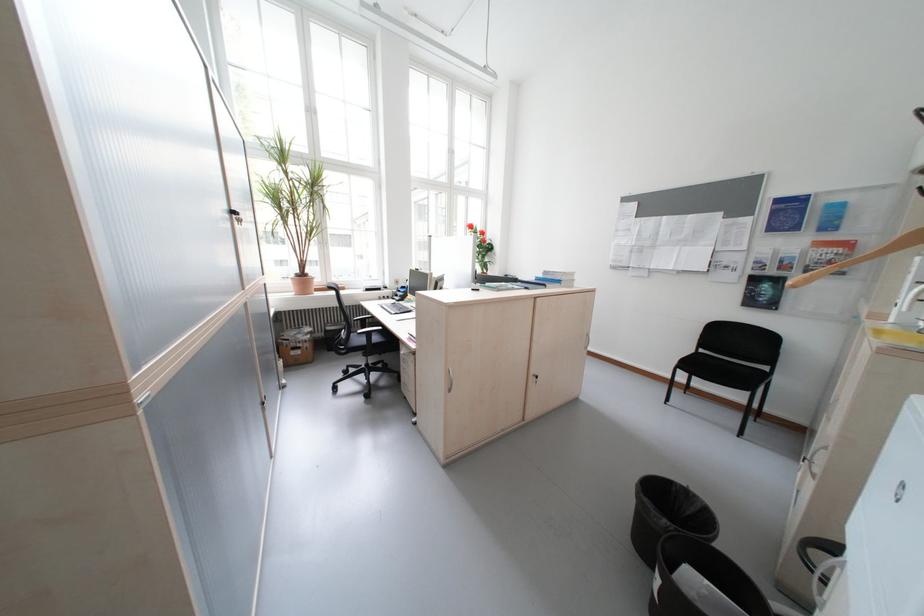
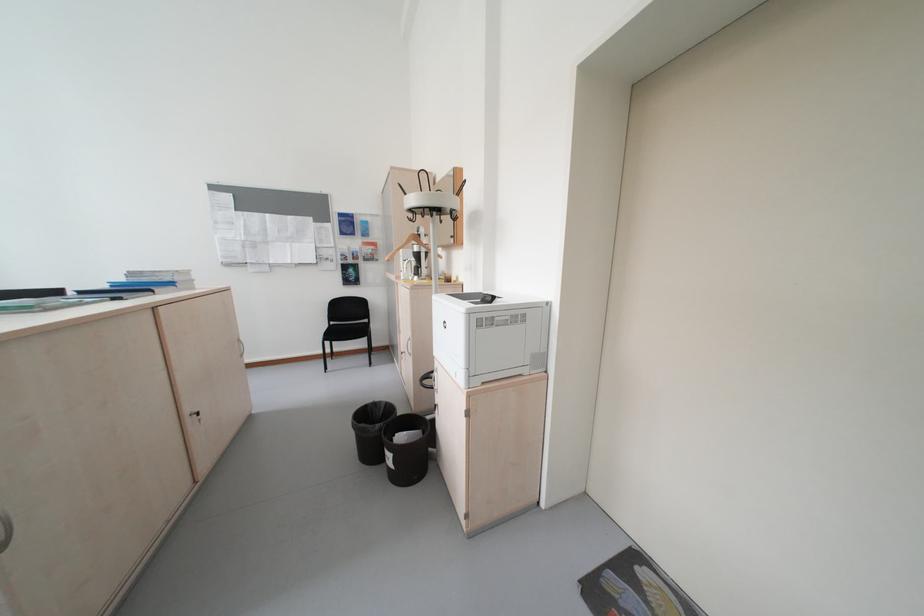
Locate, in the second image, the point that corresponds to point (834, 450) in the first image.

(419, 341)